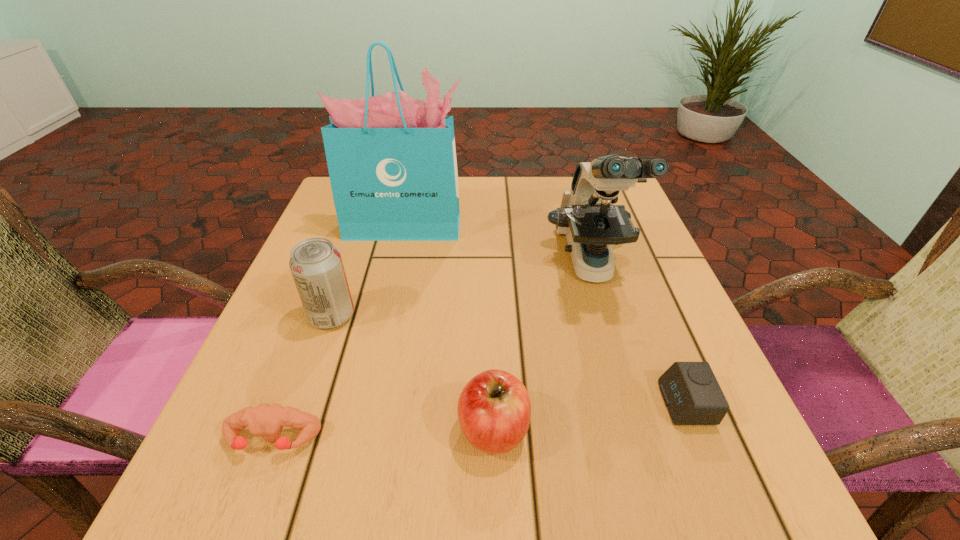
You are a GUI agent. You are given a task and a screenshot of the screen. Output one action in this format:
    pyautogui.click(x=<x>, y=<y>)
    Task: Click on the free spot located on the left of the apple
    The width and height of the screenshot is (960, 540).
    Given the screenshot: What is the action you would take?
    pyautogui.click(x=280, y=429)

Where is `free spot located on the front-facing side of the alarm clock`? free spot located on the front-facing side of the alarm clock is located at coordinates (606, 403).

Find the location of a particular element. The height and width of the screenshot is (540, 960). free space located on the front-facing side of the alarm clock is located at coordinates (475, 403).

In order to click on vacant space located 0.300m on the front-facing side of the alarm clock in this screenshot , I will do click(x=468, y=403).

Where is `vacant space located 0.070m with the gloves of the puncher facing forward`? vacant space located 0.070m with the gloves of the puncher facing forward is located at coordinates (245, 514).

At what (x,y) coordinates should I click in order to perform the action: click on object situated at the far edge. Please return your answer as a coordinate pair (x, y). The width and height of the screenshot is (960, 540). Looking at the image, I should click on (391, 158).

Where is `apple located in the near edge section of the desktop`? apple located in the near edge section of the desktop is located at coordinates (494, 410).

Find the location of a particular element. This screenshot has width=960, height=540. puncher that is at the near edge is located at coordinates (267, 420).

Locate an element on the screen. The width and height of the screenshot is (960, 540). shopping bag that is at the left edge is located at coordinates (391, 158).

Locate an element on the screen. The height and width of the screenshot is (540, 960). soda can that is at the left edge is located at coordinates (316, 265).